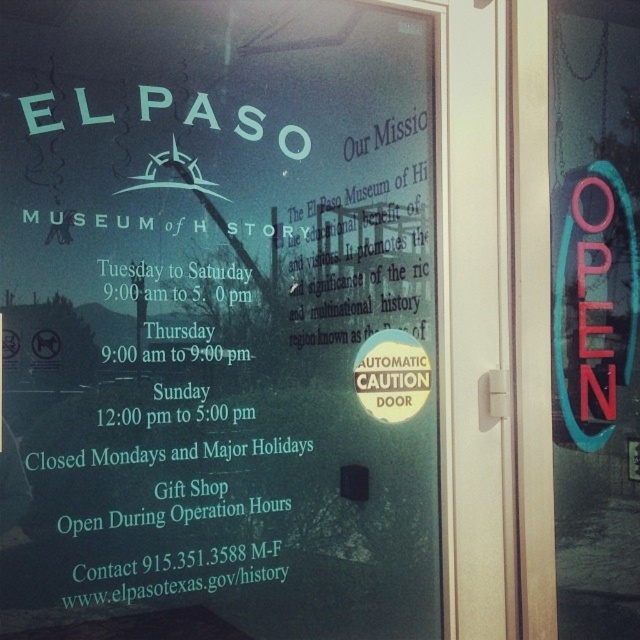
Does transparent glass sign at upper center appear on the left side of neon sign at right?

Yes, transparent glass sign at upper center is to the left of neon sign at right.

Does point (320, 118) come in front of point (570, 273)?

Yes, point (320, 118) is closer to viewer.

This screenshot has height=640, width=640. I want to click on transparent glass sign at upper center, so click(218, 321).